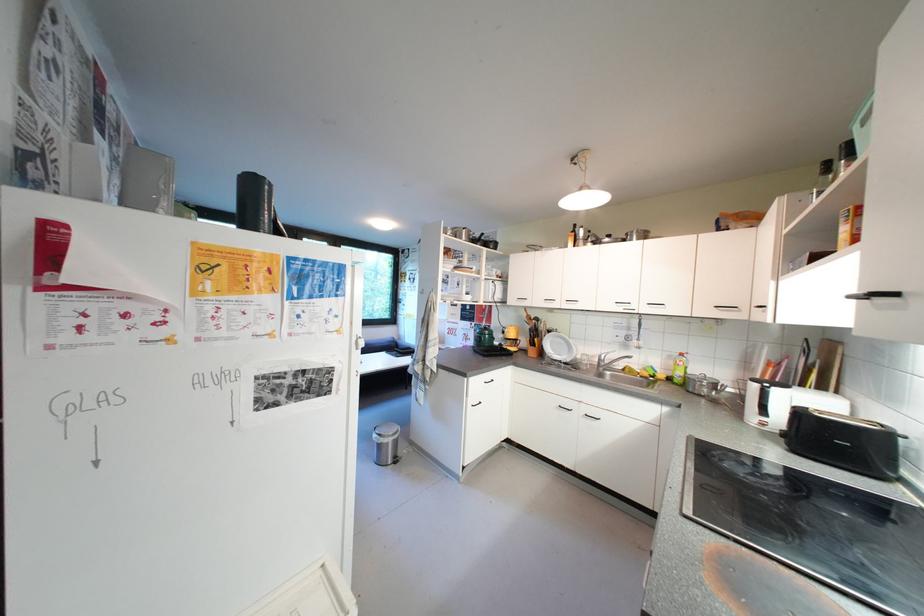
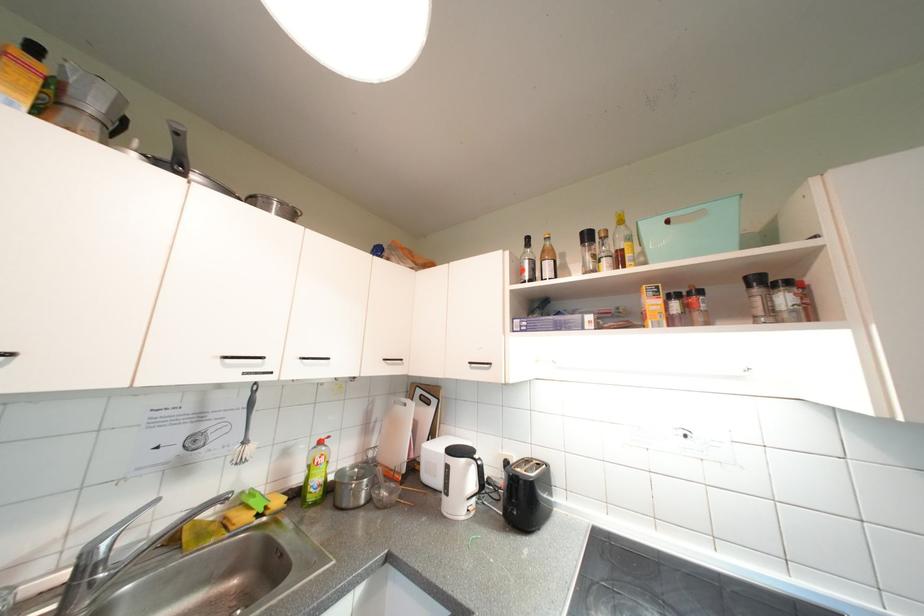
Find the pixel in the second image that matches pixel 763 387 in the first image.

(477, 466)